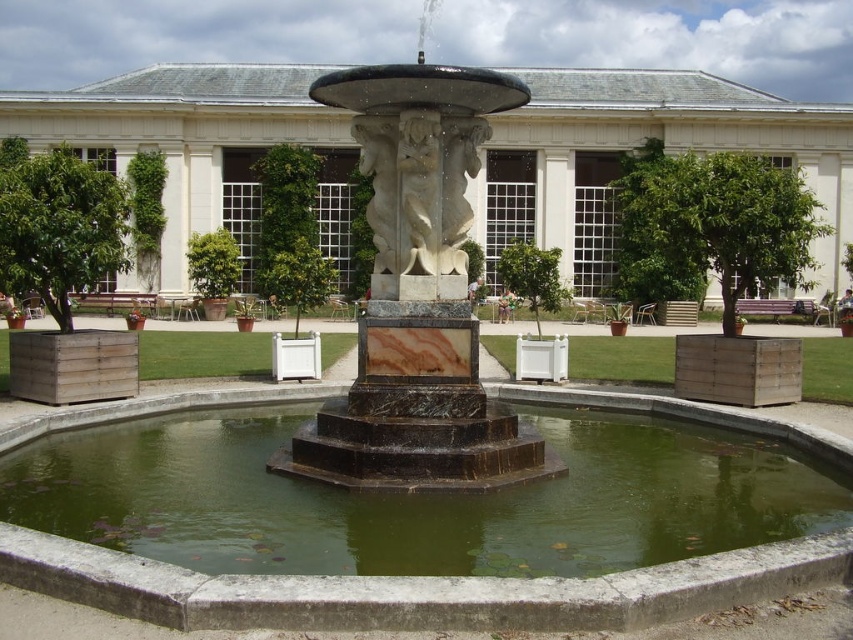
Question: Which point appears closest to the camera in this image?

Choices:
 (A) (143, 577)
 (B) (538, 80)
 (C) (521, 88)
 (D) (474, 150)

Answer: (A)

Question: Which point appears farthest from the camera in this image?

Choices:
 (A) pos(450,285)
 (B) pos(200,588)
 (C) pos(432,221)

Answer: (A)

Question: Considering the relative positions of white marble fountain at center and green marble water at center in the image provided, where is white marble fountain at center located with respect to green marble water at center?

Choices:
 (A) below
 (B) above

Answer: (B)

Question: Which of the following is the closest to the observer?

Choices:
 (A) (444, 138)
 (B) (292, 385)
 (C) (483, 486)
 (D) (164, 150)

Answer: (C)

Question: Is white marble fountain at center smaller than marble statue at center?

Choices:
 (A) yes
 (B) no

Answer: (B)

Question: Can you confirm if white marble fountain at center is thinner than white marble statue at center?

Choices:
 (A) no
 (B) yes

Answer: (A)